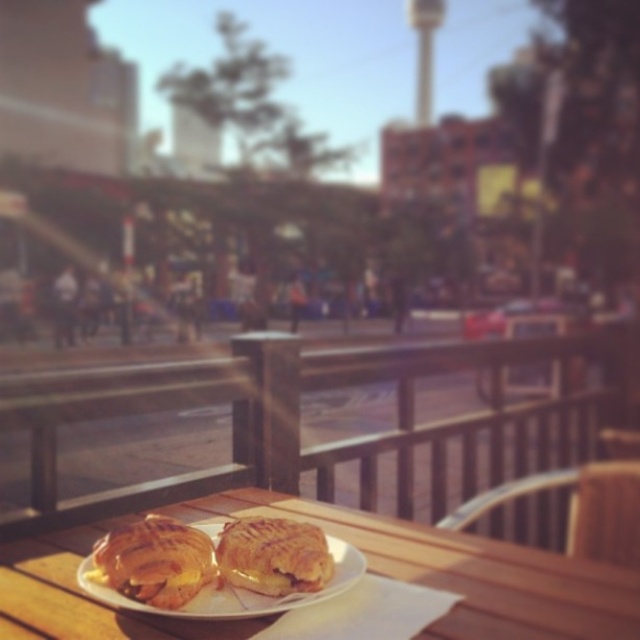
Question: Which point appears closest to the camera in this image?

Choices:
 (A) (177, 520)
 (B) (257, 518)
 (C) (243, 490)
 (D) (141, 605)

Answer: (D)

Question: Estimate the real-world distances between objects in this image. Which object is closer to the golden flaky pastry at center?

Choices:
 (A) white paper plate at center
 (B) golden flaky croissant at center
 (C) wooden table at center

Answer: (A)

Question: Which object is farther from the camera taking this photo?

Choices:
 (A) golden flaky pastry at center
 (B) wooden table at center
 (C) golden flaky croissant at center

Answer: (A)

Question: From the image, what is the correct spatial relationship of wooden table at center in relation to white paper plate at center?

Choices:
 (A) right
 (B) left

Answer: (A)

Question: Is wooden table at center wider than golden flaky pastry at center?

Choices:
 (A) no
 (B) yes

Answer: (B)

Question: Can you confirm if golden flaky croissant at center is positioned to the left of white paper plate at center?

Choices:
 (A) yes
 (B) no

Answer: (A)